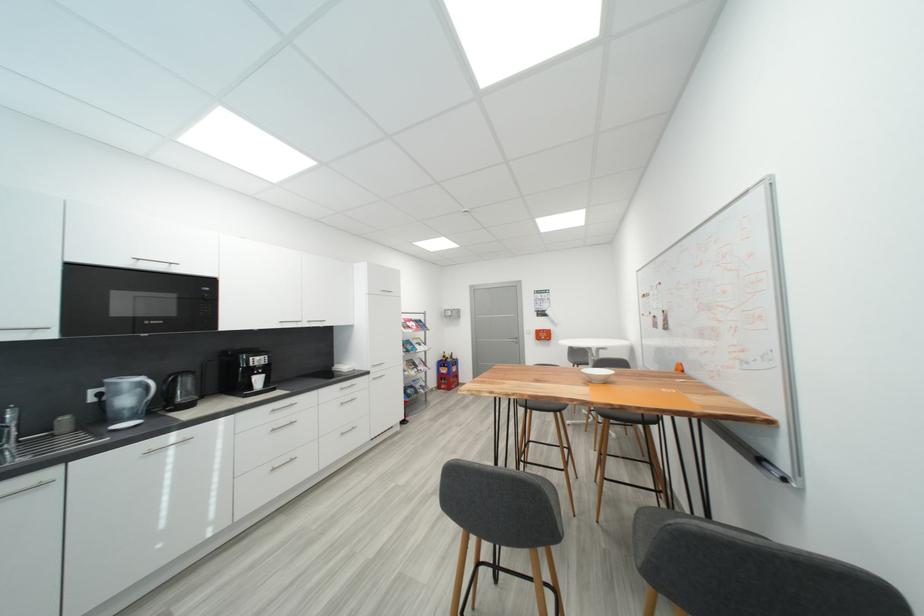
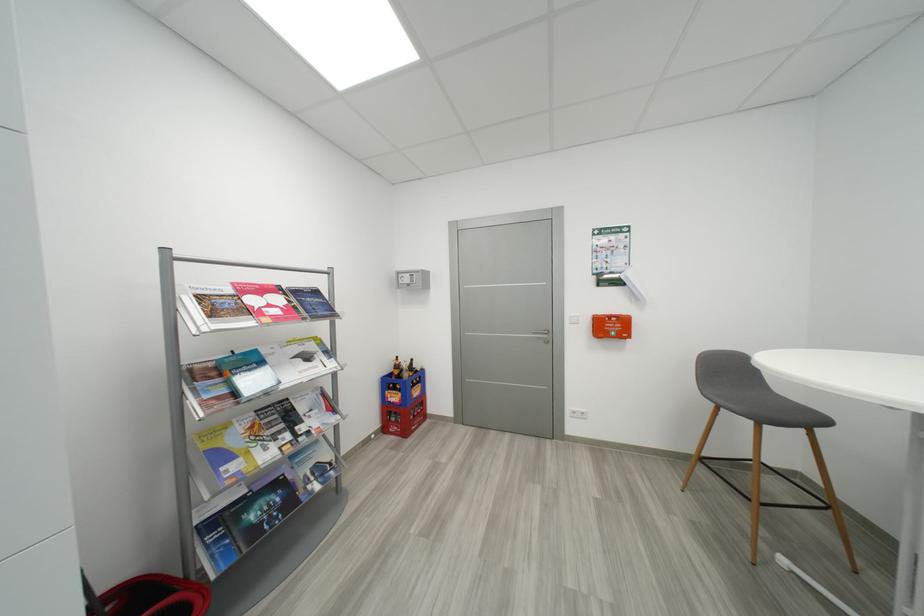
Question: The images are taken continuously from a first-person perspective. In which direction are you moving?

Choices:
 (A) Left
 (B) Right
 (C) Forward
 (D) Backward

Answer: (C)